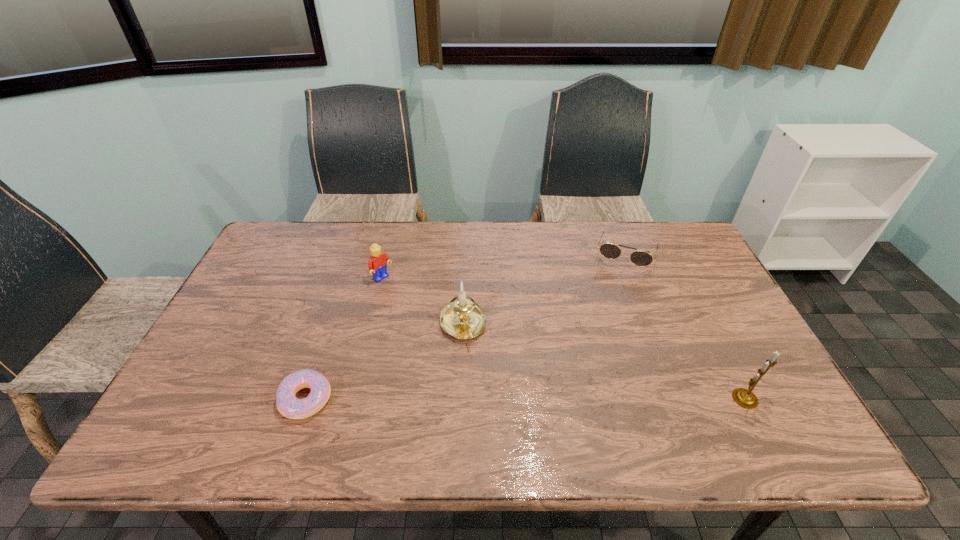
Find the location of a particular element. Image resolution: width=960 pixels, height=540 pixels. candelabrum located at the near edge is located at coordinates coord(745,398).

Where is `candelabrum situated at the right edge`? candelabrum situated at the right edge is located at coordinates (745, 398).

In order to click on sunglasses that is at the right edge in this screenshot , I will do `click(610, 251)`.

This screenshot has width=960, height=540. Identify the location of object present at the far right corner. (610, 251).

Locate an element on the screen. This screenshot has width=960, height=540. object that is at the near right corner is located at coordinates (745, 398).

Image resolution: width=960 pixels, height=540 pixels. Find the location of `free spot at the far edge of the desktop`. free spot at the far edge of the desktop is located at coordinates (492, 231).

In the image, there is a desktop. Where is `vacant space at the near edge`? vacant space at the near edge is located at coordinates (617, 398).

You are a GUI agent. You are given a task and a screenshot of the screen. Output one action in this format:
    pyautogui.click(x=<x>, y=<y>)
    Task: Click on the free spot at the left edge of the desktop
    Image resolution: width=960 pixels, height=540 pixels.
    Given the screenshot: What is the action you would take?
    pyautogui.click(x=215, y=361)

Locate an element on the screen. free location at the right edge is located at coordinates (733, 372).

Locate an element on the screen. blank space at the far left corner of the desktop is located at coordinates (305, 238).